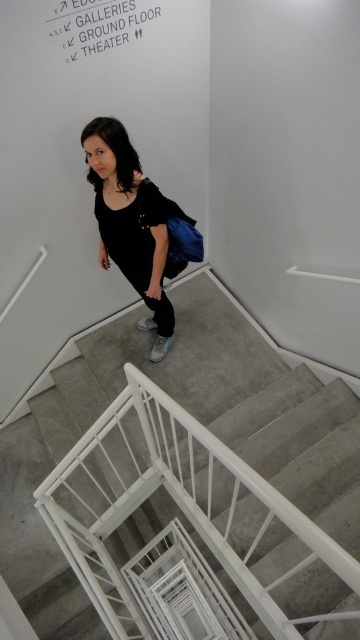
Question: Which object is closer to the camera taking this photo?

Choices:
 (A) carpeted stairs at center
 (B) white paper sign at upper center
 (C) black matte dress at center
 (D) matte black dress at center

Answer: (A)

Question: Does carpeted stairs at center have a greater width compared to matte black dress at center?

Choices:
 (A) yes
 (B) no

Answer: (A)

Question: Which is nearer to the carpeted stairs at center?

Choices:
 (A) white paper sign at upper center
 (B) black matte dress at center
 (C) matte black dress at center

Answer: (C)

Question: Among these objects, which one is farthest from the camera?

Choices:
 (A) carpeted stairs at center
 (B) white paper sign at upper center

Answer: (B)

Question: Where is black matte dress at center located in relation to white paper sign at upper center in the image?

Choices:
 (A) below
 (B) above

Answer: (A)

Question: Is carpeted stairs at center closer to the viewer compared to matte black dress at center?

Choices:
 (A) no
 (B) yes

Answer: (B)